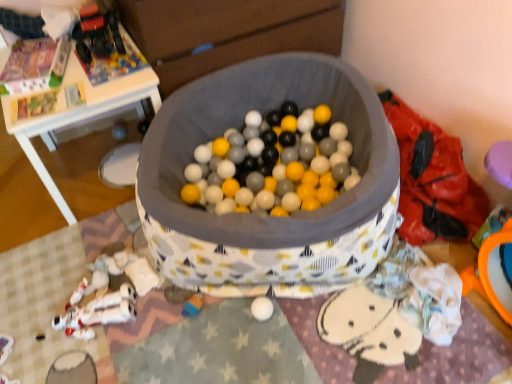
Image resolution: width=512 pixels, height=384 pixels. Identify the location of free space underneath metallic plastic toy truck at upper left, which appears as the fourth toy when ordered from the bottom (from a real-world perspective). (100, 52).